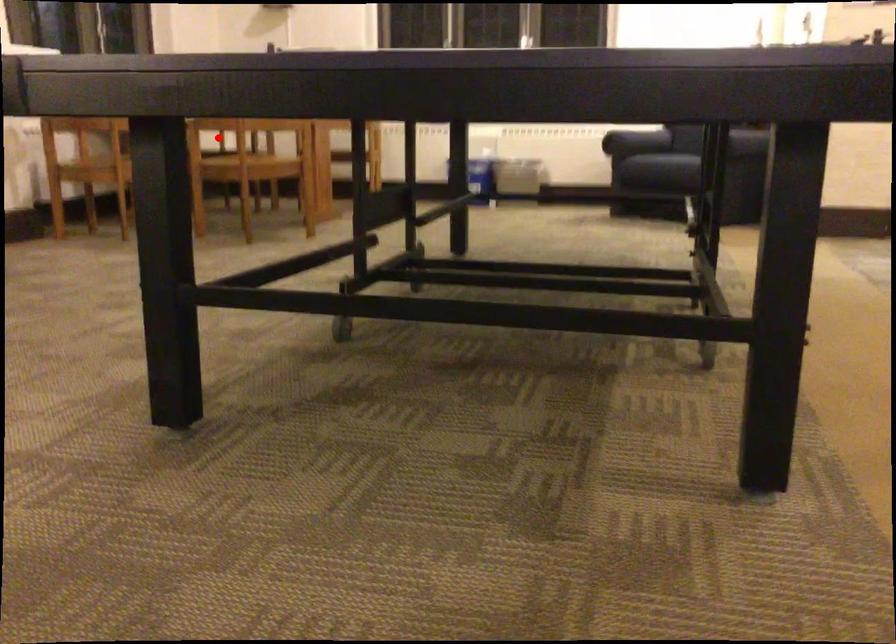
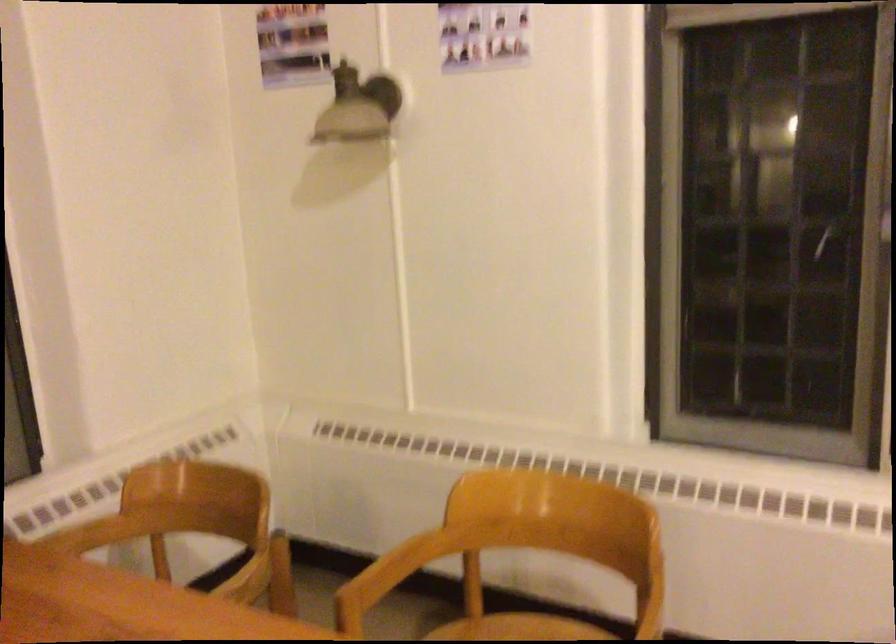
Question: I am providing you with two images of the same scene from different viewpoints. A red point is shown in image1. For the corresponding object point in image2, is it positioned nearer or farther from the camera?

Choices:
 (A) Nearer
 (B) Farther

Answer: (A)